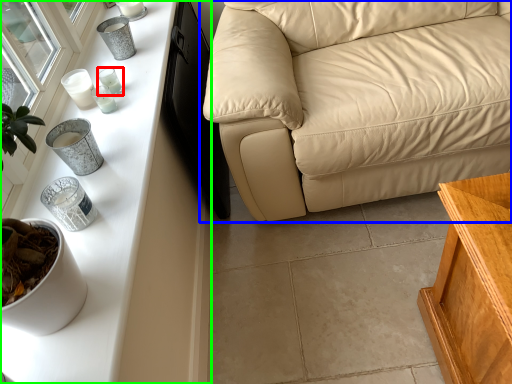
Question: Based on their relative distances, which object is nearer to candle holder (highlighted by a red box)? Choose from studio couch (highlighted by a blue box) and table (highlighted by a green box).

Choices:
 (A) studio couch
 (B) table

Answer: (B)